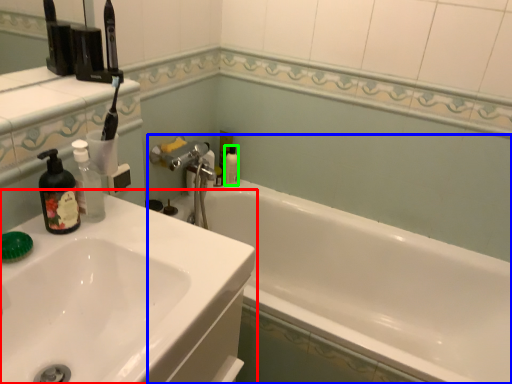
Question: Based on their relative distances, which object is nearer to sink (highlighted by a red box)? Choose from bathtub (highlighted by a blue box) and mouthwash (highlighted by a green box).

Choices:
 (A) bathtub
 (B) mouthwash

Answer: (A)